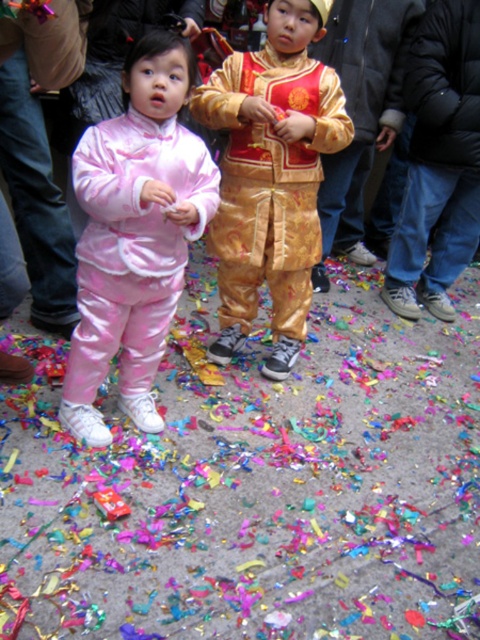
You are a photographer setting up for a group photo. You have a camera with a lens that has a maximum focus range of 20 inches. Both the pink satin outfit at center and the gold shiny outfit at center are in your frame. Can you capture both outfits in focus without moving the camera?

The distance between the pink satin outfit at center and the gold shiny outfit at center is 20.76 inches. Since the camera lens can only focus up to 20 inches, the outfits are slightly out of the focus range. You might need to adjust your position or use a different lens to ensure both are in focus.

You are a photographer setting up for a photo shoot and need to position a backdrop behind the two outfits. The backdrop is 1.5 meters wide. Given that the pink satin outfit at center is smaller than the gold shiny outfit at center, will the combined width of both outfits fit within the backdrop?

The pink satin outfit at center is smaller than the gold shiny outfit at center, but without specific measurements for each outfit, it is impossible to determine if their combined width will fit within the 1.5 meter backdrop. Additional information about their individual widths is required to make an accurate assessment.

You are a photographer setting up for a photo shoot and need to ensure that both the pink satin outfit at center and the gold shiny outfit at center are visible in the frame. Given their heights, which outfit might require you to adjust your camera angle to avoid being cut off?

The gold shiny outfit at center is taller than the pink satin outfit at center, so adjusting the camera angle to account for its height will ensure it isn not cut off.